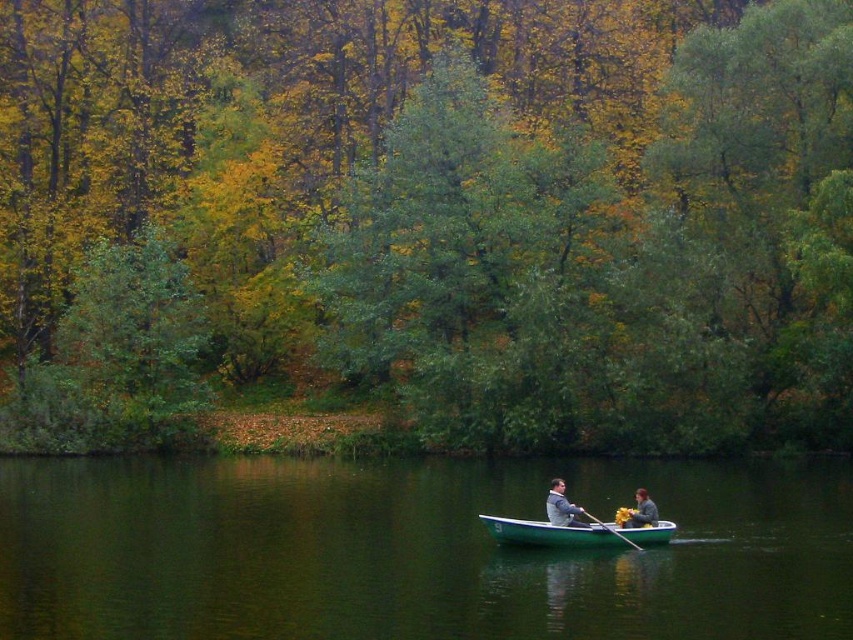
Question: Estimate the real-world distances between objects in this image. Which object is farther from the gray fabric jacket at lower center?

Choices:
 (A) gray fabric jacket at center
 (B) wooden smooth paddle at lower center
 (C) green smooth water at center

Answer: (C)

Question: Which point is farther to the camera?

Choices:
 (A) green matte tree at upper center
 (B) gray fabric jacket at center
 (C) gray fabric jacket at lower center
 (D) green plastic canoe at center

Answer: (A)

Question: Is green matte tree at upper center below gray fabric jacket at center?

Choices:
 (A) yes
 (B) no

Answer: (B)

Question: Is green matte tree at upper center below green plastic canoe at center?

Choices:
 (A) yes
 (B) no

Answer: (B)

Question: Does green plastic canoe at center have a lesser width compared to gray fabric jacket at center?

Choices:
 (A) yes
 (B) no

Answer: (B)

Question: Which point is closer to the camera taking this photo?

Choices:
 (A) (550, 502)
 (B) (659, 369)
 (C) (291, 620)

Answer: (C)